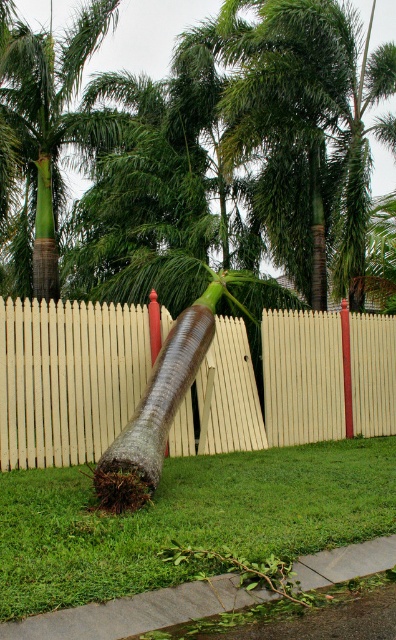
Question: In this image, where is white wood fence at center located relative to green matte palm tree at center?

Choices:
 (A) below
 (B) above

Answer: (A)

Question: Which is nearer to the white wood fence at center?

Choices:
 (A) gray concrete curb at lower center
 (B) green matte palm tree at center
 (C) green grass at lower center

Answer: (C)

Question: Does green grass at lower center have a larger size compared to green matte palm tree at center?

Choices:
 (A) yes
 (B) no

Answer: (B)

Question: Which is nearer to the white wood fence at center?

Choices:
 (A) gray concrete curb at lower center
 (B) green grass at lower center

Answer: (B)

Question: Is white wood fence at center positioned at the back of gray concrete curb at lower center?

Choices:
 (A) yes
 (B) no

Answer: (A)

Question: Which object is closer to the camera taking this photo?

Choices:
 (A) green matte palm tree at center
 (B) gray concrete curb at lower center
 (C) white wood fence at center
 (D) green grass at lower center

Answer: (B)